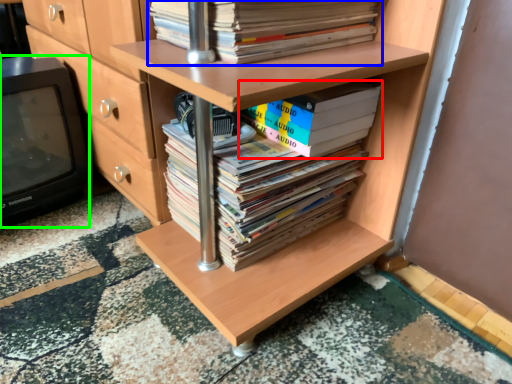
Question: Which object is the closest to the book (highlighted by a red box)? Choose among these: book (highlighted by a blue box) or wide (highlighted by a green box).

Choices:
 (A) book
 (B) wide

Answer: (A)